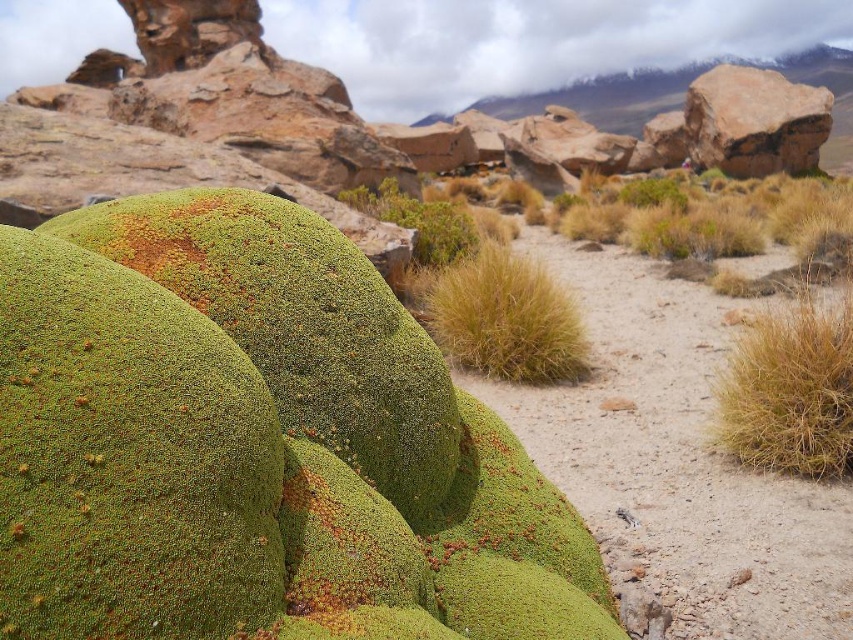
You are standing at the center of the mossy boulders and want to collect some dry straw. Which direction should you walk to reach the dry straw located at point (790, 388)?

The dry straw is at the right side of the image, so you should walk towards the right to reach it.